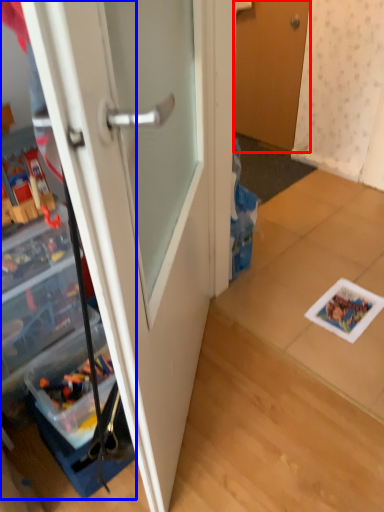
Question: Among these objects, which one is nearest to the camera, door (highlighted by a red box) or cabinetry (highlighted by a blue box)?

Choices:
 (A) door
 (B) cabinetry

Answer: (B)